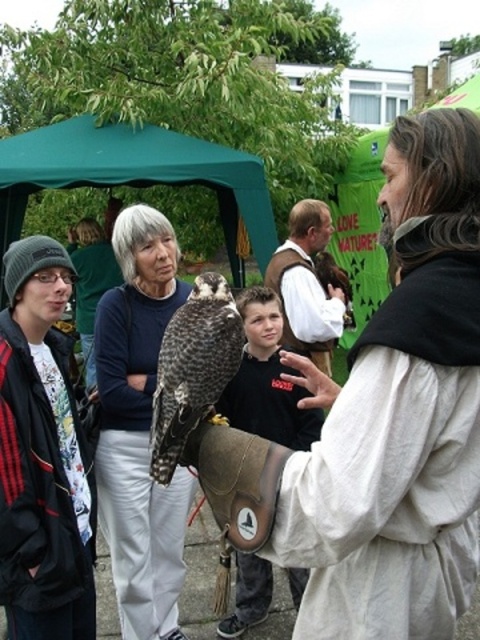
You are a photographer trying to capture a closeup shot of the speckled feathered falcon at center without including the matte black jacket at center in the frame. Can you adjust your camera angle to achieve this?

The matte black jacket at center is wider than the speckled feathered falcon at center, so adjusting the camera angle might be possible if the falcon is positioned away from the jacket. However, since both are at center, it may be challenging to exclude the jacket entirely without moving closer or using a tighter zoom.

You are a photographer trying to capture the falconer and his glove in a single shot. Since the white cotton robe at center is much taller than the brown leather glove at center, will the glove be visible in the photo if you focus on the robe?

The white cotton robe at center is much taller than the brown leather glove at center, so if you focus on the robe, the brown leather glove at center will still be visible in the photo because the glove is part of the robe holder and positioned near the lower part of the robe.